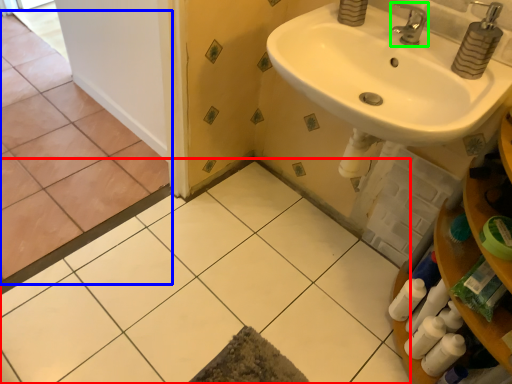
Question: Based on their relative distances, which object is nearer to ceramic tile (highlighted by a red box)? Choose from ceramic tile (highlighted by a blue box) and tap (highlighted by a green box).

Choices:
 (A) ceramic tile
 (B) tap

Answer: (A)